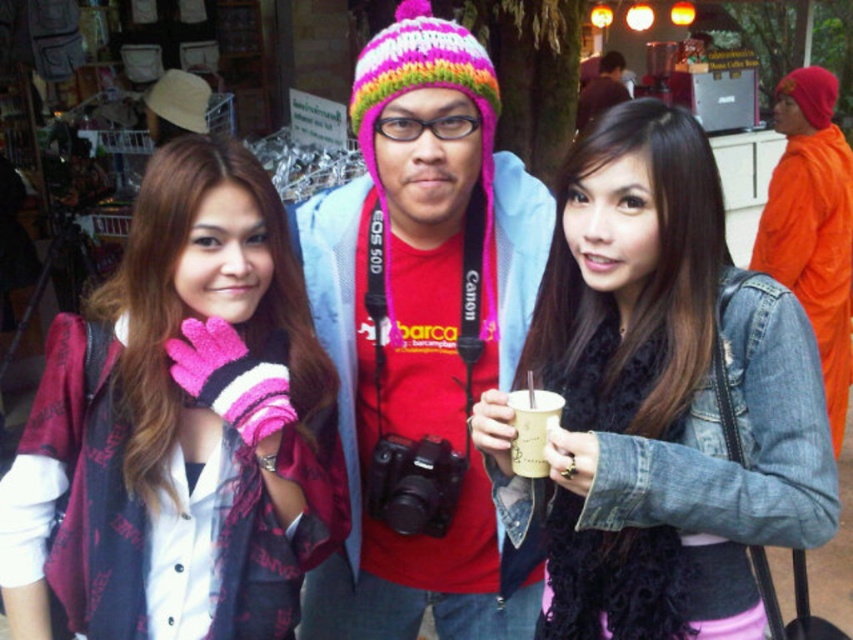
Is pink knitted gloves at center positioned before denim jacket at center?

No, it is behind denim jacket at center.

Which is above, pink knitted gloves at center or denim jacket at center?

pink knitted gloves at center is above.

The image size is (853, 640). I want to click on pink knitted gloves at center, so click(181, 426).

Describe the element at coordinates (181, 426) in the screenshot. I see `pink knitted gloves at center` at that location.

Who is more forward, (45,541) or (550,396)?

Positioned in front is point (550,396).

Who is more distant from viewer, (175, 330) or (531, 454)?

The point (175, 330) is behind.

This screenshot has height=640, width=853. What are the coordinates of `pink knitted gloves at center` in the screenshot? It's located at (181, 426).

Can you confirm if denim jacket at center is smaller than white paper cup at center?

Incorrect, denim jacket at center is not smaller in size than white paper cup at center.

Does denim jacket at center have a greater width compared to white paper cup at center?

Correct, the width of denim jacket at center exceeds that of white paper cup at center.

Does point (712, 486) lie in front of point (525, 465)?

Yes, point (712, 486) is closer to viewer.

You are a GUI agent. You are given a task and a screenshot of the screen. Output one action in this format:
    pyautogui.click(x=<x>, y=<y>)
    Task: Click on the denim jacket at center
    
    Given the screenshot: What is the action you would take?
    pyautogui.click(x=659, y=400)